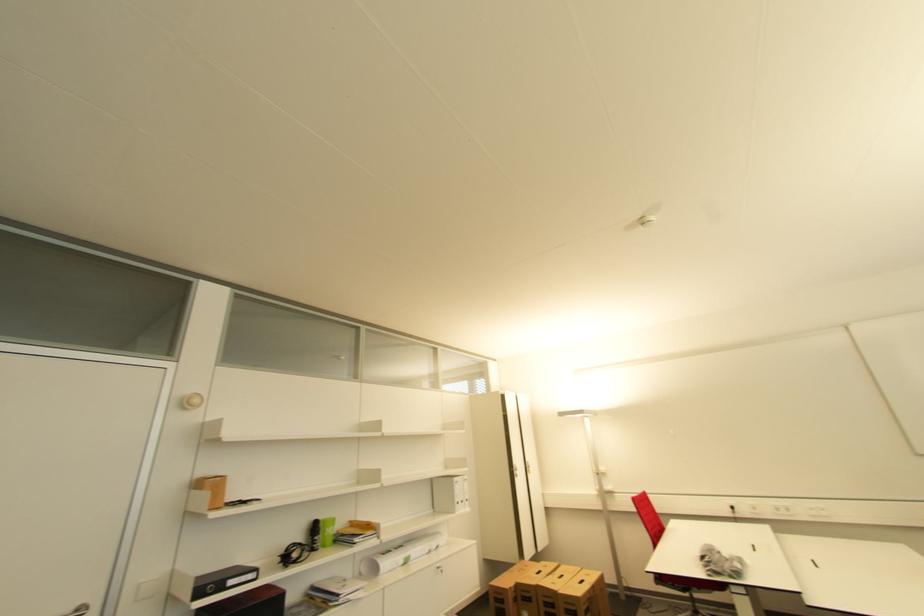
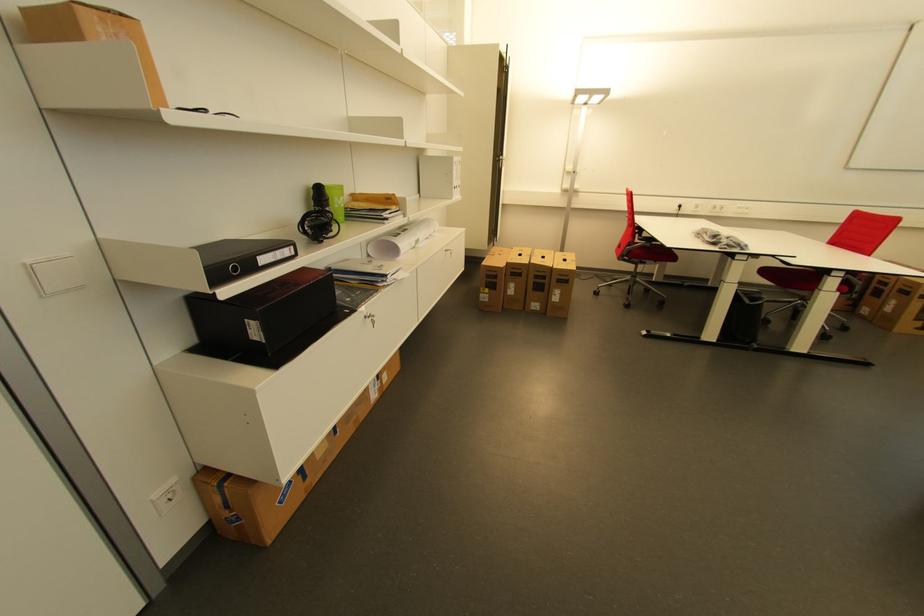
Where in the second image is the point corresponding to the point at 326,527 from the first image?

(333, 193)